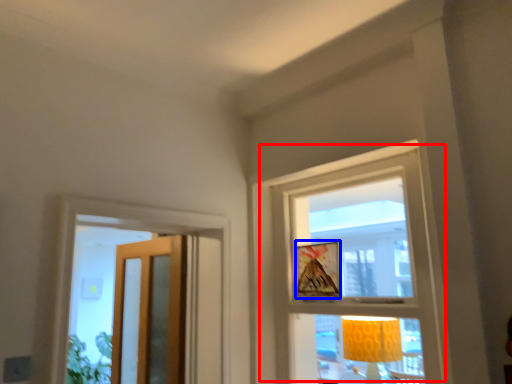
Question: Which of the following is the farthest to the observer, window (highlighted by a red box) or picture frame (highlighted by a blue box)?

Choices:
 (A) window
 (B) picture frame

Answer: (B)